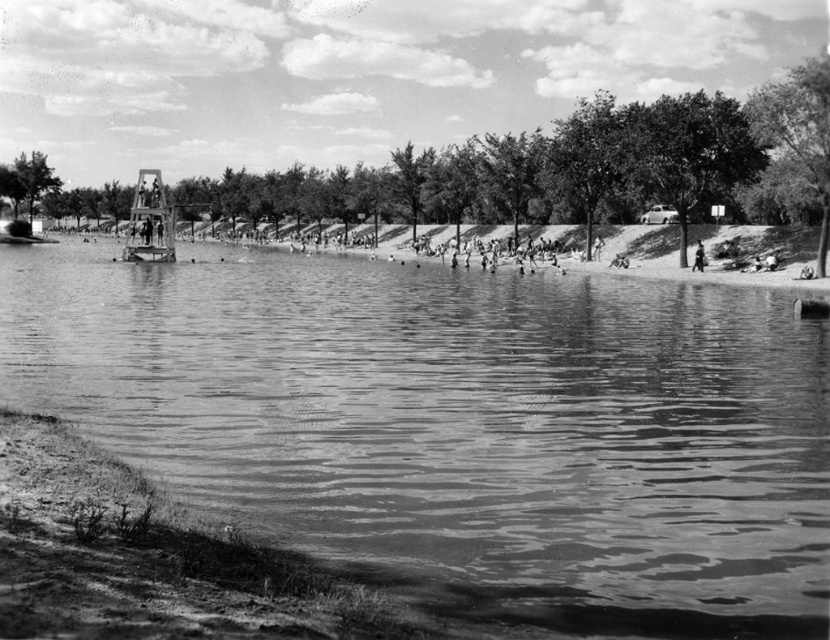
In the scene shown: Measure the distance from smooth water at center to metallic structure at center.

24.24 meters

Is smooth water at center further to the viewer compared to metallic structure at center?

No, smooth water at center is in front of metallic structure at center.

Measure the distance between smooth water at center and camera.

A distance of 22.90 feet exists between smooth water at center and camera.

Where is `smooth water at center`? smooth water at center is located at coordinates (460, 426).